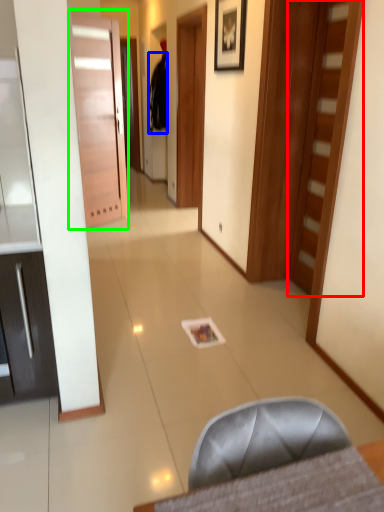
Question: Estimate the real-world distances between objects in this image. Which object is closer to door (highlighted by a red box), robe (highlighted by a blue box) or door (highlighted by a green box)?

Choices:
 (A) robe
 (B) door

Answer: (B)